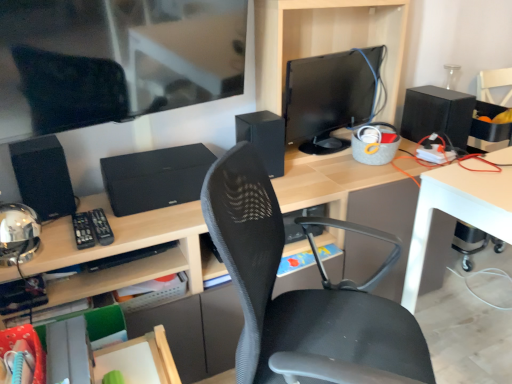
Question: From the image's perspective, is black textured speaker at center located above or below white glossy table at lower right?

Choices:
 (A) above
 (B) below

Answer: (A)

Question: Considering the relative positions of black textured speaker at center and white glossy table at lower right in the image provided, is black textured speaker at center to the left or to the right of white glossy table at lower right?

Choices:
 (A) right
 (B) left

Answer: (B)

Question: Which object is positioned closest to the black matte speaker at right, which ranks as the 3th speaker in front-to-back order?

Choices:
 (A) matte black desk at center
 (B) black matte speaker at left, placed as the third speaker when sorted from right to left
 (C) black textured speaker at center
 (D) black matte speaker at center, acting as the 2th speaker starting from the back
 (E) matte black monitor at center

Answer: (A)

Question: Which is nearer to the black matte speaker at center, which is the 2th speaker in front-to-back order?

Choices:
 (A) white glossy table at lower right
 (B) matte black monitor at center
 (C) black textured speaker at center
 (D) matte black desk at center
 (E) black matte speaker at right, acting as the first speaker starting from the right

Answer: (B)